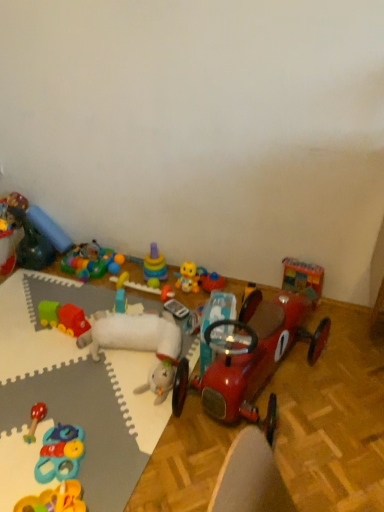
In order to click on vacant space in front of wooden rattle at lower left, the seventh toy viewed from the right in this screenshot , I will do `click(19, 463)`.